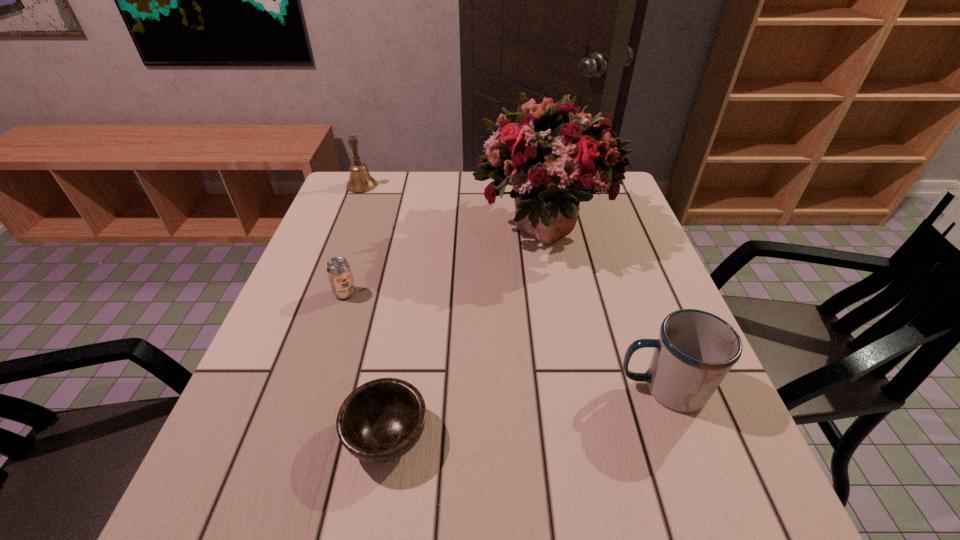
The image size is (960, 540). I want to click on blank space that satisfies the following two spatial constraints: 1. on the front side of the bell; 2. on the left side of the third nearest object, so click(320, 293).